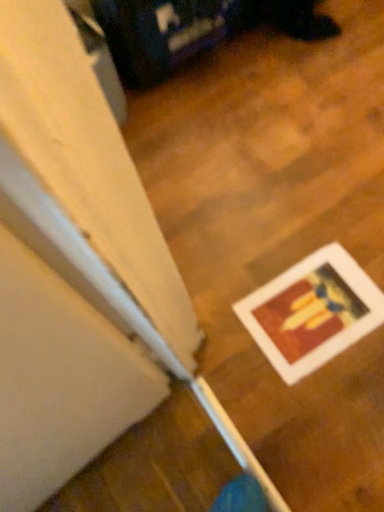
Where is `vacant point above white matte picture frame at lower right (from a real-world perspective)`? This screenshot has width=384, height=512. vacant point above white matte picture frame at lower right (from a real-world perspective) is located at coordinates tap(309, 308).